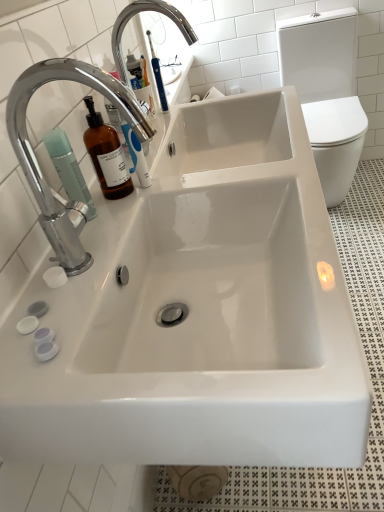
The height and width of the screenshot is (512, 384). Identify the location of vacant point to the right of matte green pump bottle at left. (152, 197).